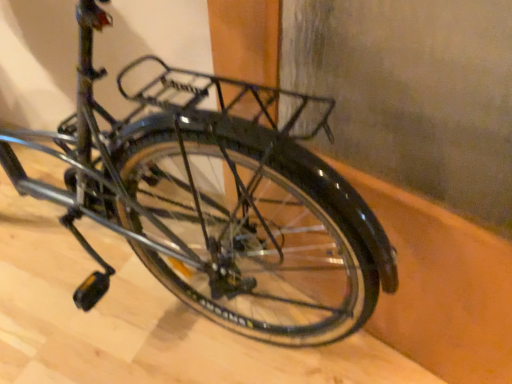
At what (x,y) coordinates should I click in order to perform the action: click on matte black bicycle at center. Please return your answer as a coordinate pair (x, y). The height and width of the screenshot is (384, 512). Looking at the image, I should click on (211, 202).

What is the approximate width of matte black bicycle at center?

It is 66.12 centimeters.

Describe the element at coordinates (211, 202) in the screenshot. The width and height of the screenshot is (512, 384). I see `matte black bicycle at center` at that location.

Where is `matte black bicycle at center`? The height and width of the screenshot is (384, 512). matte black bicycle at center is located at coordinates (211, 202).